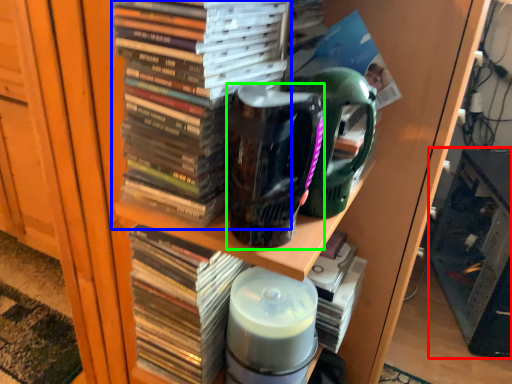
Question: Which is nearer to the shelf (highlighted by a red box)? book (highlighted by a blue box) or mug (highlighted by a green box).

Choices:
 (A) book
 (B) mug

Answer: (B)